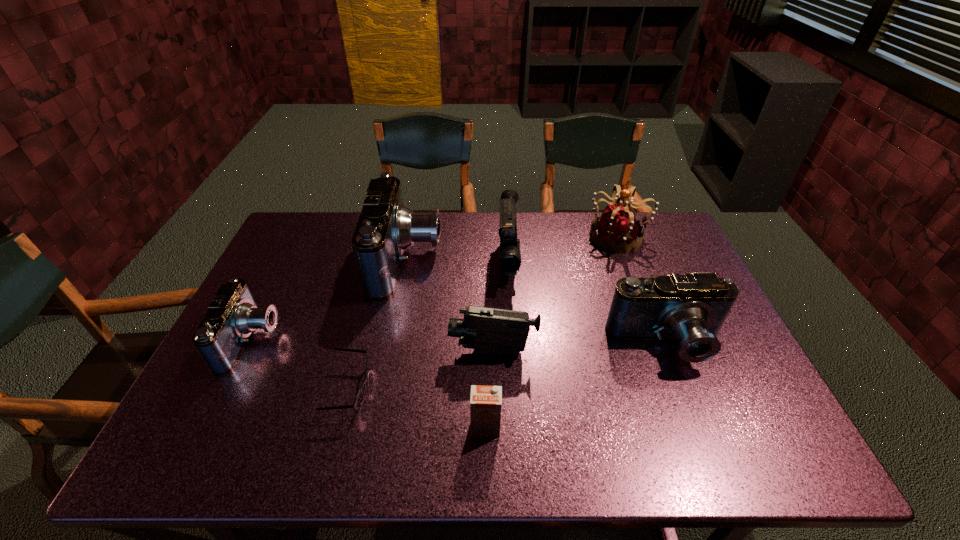
I want to click on vacant space at the far edge, so click(x=427, y=253).

Locate an element on the screen. free spot at the near edge of the desktop is located at coordinates (466, 455).

You are a GUI agent. You are given a task and a screenshot of the screen. Output one action in this format:
    pyautogui.click(x=<x>, y=<y>)
    Task: Click on the vacant space at the left edge
    
    Given the screenshot: What is the action you would take?
    pyautogui.click(x=273, y=300)

In the image, there is a desktop. In order to click on vacant space at the right edge in this screenshot , I will do `click(677, 267)`.

Locate an element on the screen. This screenshot has width=960, height=540. vacant region at the far left corner is located at coordinates (310, 221).

Find the location of `vacant space at the near right corner`. vacant space at the near right corner is located at coordinates (779, 436).

Locate an element on the screen. vacant area between the leftmost blue camcorder and the second blue camcorder from right to left is located at coordinates (329, 300).

The image size is (960, 540). Identify the location of vacant region between the orange orange juice and the red tiara. (552, 332).

Locate an element on the screen. Image resolution: width=960 pixels, height=540 pixels. vacant area that lies between the fourth camcorder from right to left and the smaller black camcorder is located at coordinates (450, 306).

The image size is (960, 540). What are the coordinates of `free space between the farther black camcorder and the tiara` in the screenshot? It's located at (563, 250).